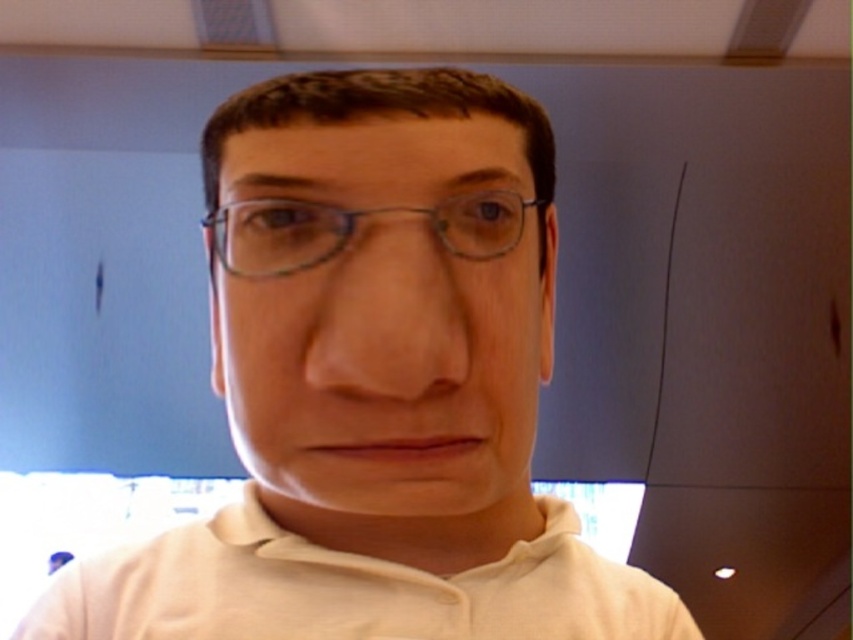
Is matte plastic face at center further to camera compared to clear plastic glasses at center?

That is False.

Which is below, matte plastic face at center or clear plastic glasses at center?

Positioned lower is matte plastic face at center.

At what (x,y) coordinates should I click in order to perform the action: click on matte plastic face at center. Please return your answer as a coordinate pair (x, y). The width and height of the screenshot is (853, 640). Looking at the image, I should click on (389, 371).